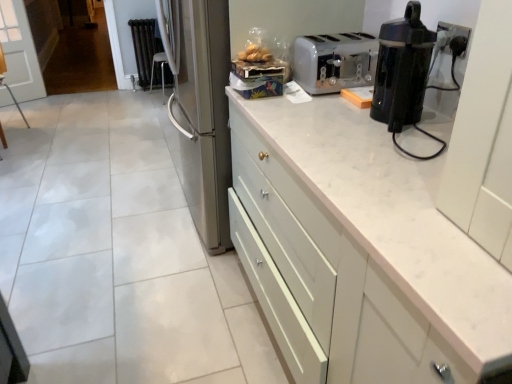
Identify the location of vacant area in front of black plastic coffee maker at upper right. (402, 136).